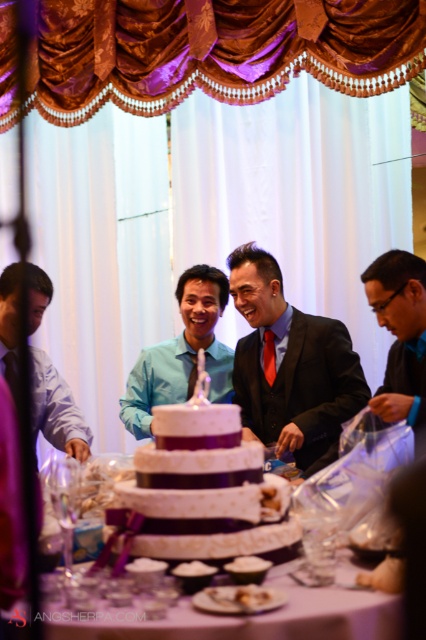
Question: Can you confirm if white porcelain plate at center is positioned to the left of red satin tie at center?

Choices:
 (A) no
 (B) yes

Answer: (B)

Question: Among these points, which one is nearest to the camera?

Choices:
 (A) (187, 269)
 (B) (37, 360)

Answer: (B)

Question: Is matte black suit at lower right wider than red satin tie at center?

Choices:
 (A) yes
 (B) no

Answer: (A)

Question: Among these objects, which one is nearest to the camera?

Choices:
 (A) matte blue shirt at left
 (B) purple satin cake at center
 (C) black satin suit at center

Answer: (B)

Question: Which of these objects is positioned farthest from the blue satin shirt at center?

Choices:
 (A) matte black suit at lower right
 (B) white porcelain plate at center
 (C) purple satin cake at center

Answer: (B)

Question: Considering the relative positions of matte black suit at lower right and matte blue shirt at left in the image provided, where is matte black suit at lower right located with respect to matte blue shirt at left?

Choices:
 (A) left
 (B) right

Answer: (B)